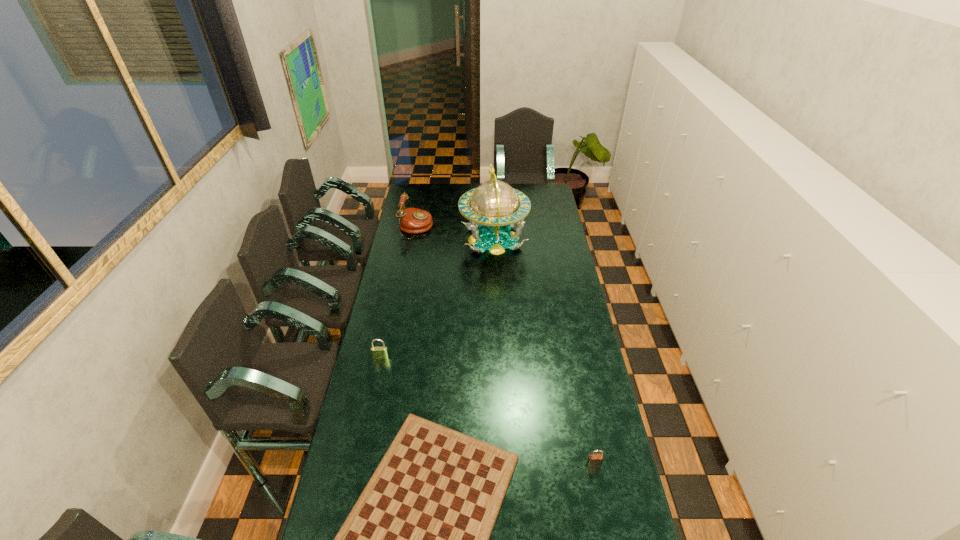
Locate an element on the screen. The width and height of the screenshot is (960, 540). globe is located at coordinates (492, 208).

Image resolution: width=960 pixels, height=540 pixels. In order to click on the second tallest object in this screenshot , I will do `click(411, 220)`.

The image size is (960, 540). What are the coordinates of `the third nearest object` in the screenshot? It's located at (377, 352).

Image resolution: width=960 pixels, height=540 pixels. What are the coordinates of `the taller padlock` in the screenshot? It's located at (377, 352).

The image size is (960, 540). I want to click on the nearer padlock, so click(594, 460).

Locate an element on the screen. This screenshot has height=540, width=960. the rightmost object is located at coordinates (594, 460).

Identify the location of vacant space located 0.100m on the left of the globe. (441, 239).

You are a GUI agent. You are given a task and a screenshot of the screen. Output one action in this format:
    pyautogui.click(x=<x>, y=<y>)
    Task: Click on the free spot located 0.300m on the dial of the telephone
    
    Given the screenshot: What is the action you would take?
    pyautogui.click(x=486, y=227)

Find the location of a particular element. The width and height of the screenshot is (960, 540). free region located on the front-facing side of the taller padlock is located at coordinates (371, 404).

Locate an element on the screen. This screenshot has width=960, height=540. vacant space located 0.160m on the front-facing side of the second shortest object is located at coordinates (605, 519).